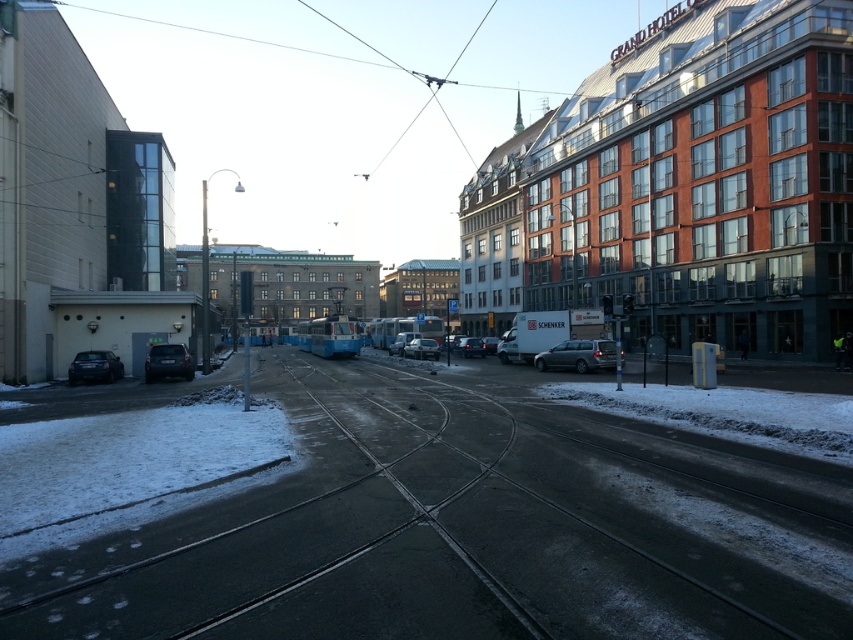
Who is higher up, silver metallic car at center or satin silver sedan at center?

silver metallic car at center is above.

Does silver metallic car at center appear on the left side of satin silver sedan at center?

Incorrect, silver metallic car at center is not on the left side of satin silver sedan at center.

Does point (589, 371) come farther from viewer compared to point (426, 348)?

That is False.

The height and width of the screenshot is (640, 853). Find the location of `silver metallic car at center`. silver metallic car at center is located at coordinates (578, 355).

Who is more forward, (488, 625) or (421, 337)?

Point (488, 625) is in front.

Does smooth asphalt track at center appear on the left side of satin silver sedan at center?

In fact, smooth asphalt track at center is to the right of satin silver sedan at center.

You are a GUI agent. You are given a task and a screenshot of the screen. Output one action in this format:
    pyautogui.click(x=<x>, y=<y>)
    Task: Click on the smooth asphalt track at center
    The image size is (853, 640).
    Given the screenshot: What is the action you would take?
    pyautogui.click(x=467, y=529)

Which is in front, point (590, 346) or point (469, 353)?

Point (590, 346)

Is point (611, 369) positioned after point (477, 337)?

No, (611, 369) is closer to viewer.

Identify the location of silver metallic car at center. (578, 355).